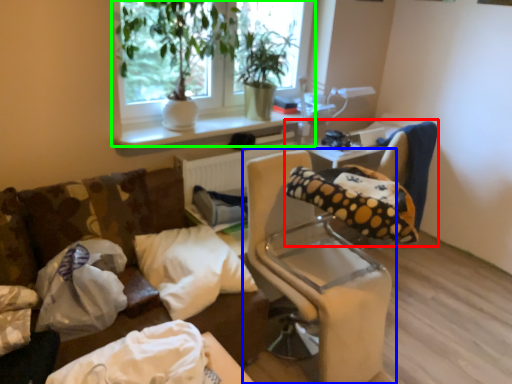
Question: Estimate the real-world distances between objects in this image. Which object is closer to bean bag chair (highlighted by a red box), furniture (highlighted by a blue box) or window (highlighted by a green box)?

Choices:
 (A) furniture
 (B) window

Answer: (A)